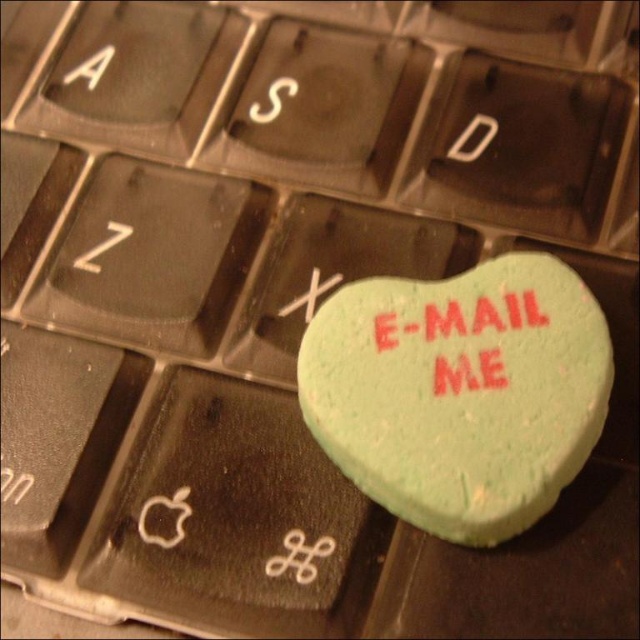
You are trying to decide which heart to use as a paperweight. The green matte heart at center and the red rubber heart at center are both on your keyboard. Which one can you choose if you need a larger paperweight?

The green matte heart at center is larger in size than the red rubber heart at center, so you should choose the green matte heart at center as it is bigger and can serve as a better paperweight.

Consider the image. You are a delivery robot that needs to place a package on the keyboard. The package is 3 inches wide. There are two hearts on the keyboard, a green matte heart at center and a red rubber heart at center. Can you place the package between them without moving the hearts?

The distance between the green matte heart at center and the red rubber heart at center is 2.74 inches. Since the package is 3 inches wide, which is wider than the space between them, you cannot place the package between them without moving the hearts.